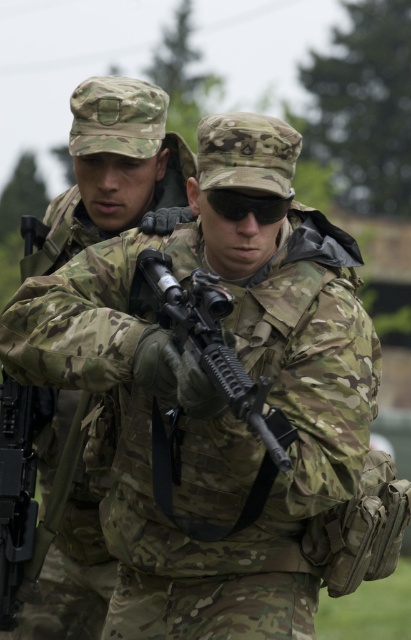
Question: Among these points, which one is farthest from the camera?

Choices:
 (A) (57, 253)
 (B) (170, 269)

Answer: (A)

Question: Does camo uniform at center appear on the right side of matte black rifle at center?

Choices:
 (A) no
 (B) yes

Answer: (A)

Question: Can you confirm if camo uniform at center is bigger than matte black rifle at center?

Choices:
 (A) yes
 (B) no

Answer: (A)

Question: Which of the following is the closest to the observer?

Choices:
 (A) matte black rifle at center
 (B) camo uniform at center

Answer: (A)

Question: Which point appears closest to the camera in this image?

Choices:
 (A) (226, 356)
 (B) (122, 150)

Answer: (A)

Question: Does camo uniform at center have a smaller size compared to matte black rifle at center?

Choices:
 (A) no
 (B) yes

Answer: (A)